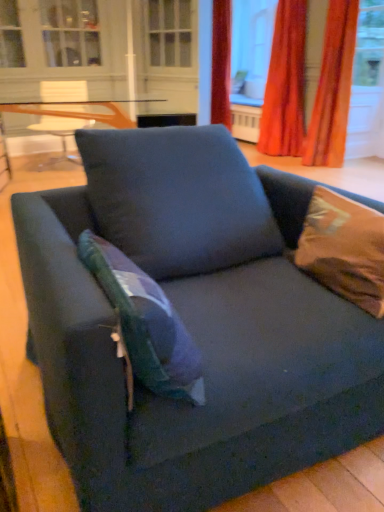
Question: Considering the relative positions of velvet orange curtain at upper right, which appears as the 1th curtain when viewed from the left, and teal fabric pillow at center, which is the 2th pillow in right-to-left order, in the image provided, is velvet orange curtain at upper right, which appears as the 1th curtain when viewed from the left, to the right of teal fabric pillow at center, which is the 2th pillow in right-to-left order, from the viewer's perspective?

Choices:
 (A) yes
 (B) no

Answer: (A)

Question: Can you confirm if velvet orange curtain at upper right, which appears as the 1th curtain when viewed from the left, is wider than teal fabric pillow at center, positioned as the first pillow in left-to-right order?

Choices:
 (A) no
 (B) yes

Answer: (B)

Question: Considering the relative sizes of velvet orange curtain at upper right, which appears as the 2th curtain when viewed from the right, and teal fabric pillow at center, positioned as the first pillow in left-to-right order, in the image provided, is velvet orange curtain at upper right, which appears as the 2th curtain when viewed from the right, taller than teal fabric pillow at center, positioned as the first pillow in left-to-right order,?

Choices:
 (A) yes
 (B) no

Answer: (A)

Question: Is velvet orange curtain at upper right, which appears as the 1th curtain when viewed from the left, not inside teal fabric pillow at center, positioned as the first pillow in left-to-right order?

Choices:
 (A) yes
 (B) no

Answer: (A)

Question: From a real-world perspective, is velvet orange curtain at upper right, which appears as the 1th curtain when viewed from the left, positioned under teal fabric pillow at center, positioned as the first pillow in left-to-right order, based on gravity?

Choices:
 (A) no
 (B) yes

Answer: (A)

Question: From the image's perspective, is velvet orange curtain at upper right, marked as the 2th curtain in a left-to-right arrangement, located above or below transparent glass window screen at upper center?

Choices:
 (A) above
 (B) below

Answer: (B)

Question: Is velvet orange curtain at upper right, the first curtain from the right, taller or shorter than transparent glass window screen at upper center?

Choices:
 (A) tall
 (B) short

Answer: (A)

Question: Based on their sizes in the image, would you say velvet orange curtain at upper right, marked as the 2th curtain in a left-to-right arrangement, is bigger or smaller than transparent glass window screen at upper center?

Choices:
 (A) small
 (B) big

Answer: (A)

Question: Is velvet orange curtain at upper right, marked as the 2th curtain in a left-to-right arrangement, inside or outside of transparent glass window screen at upper center?

Choices:
 (A) outside
 (B) inside

Answer: (A)

Question: From the image's perspective, relative to brown satin pillow at upper right, marked as the 1th pillow in a right-to-left arrangement, is velvet orange curtain at upper right, marked as the 2th curtain in a left-to-right arrangement, above or below?

Choices:
 (A) above
 (B) below

Answer: (A)

Question: Based on their positions, is velvet orange curtain at upper right, the first curtain from the right, located to the left or right of brown satin pillow at upper right, marked as the 1th pillow in a right-to-left arrangement?

Choices:
 (A) right
 (B) left

Answer: (A)

Question: Which is correct: velvet orange curtain at upper right, marked as the 2th curtain in a left-to-right arrangement, is inside brown satin pillow at upper right, marked as the 1th pillow in a right-to-left arrangement, or outside of it?

Choices:
 (A) outside
 (B) inside

Answer: (A)

Question: Considering the positions of velvet orange curtain at upper right, marked as the 2th curtain in a left-to-right arrangement, and brown satin pillow at upper right, marked as the 1th pillow in a right-to-left arrangement, in the image, is velvet orange curtain at upper right, marked as the 2th curtain in a left-to-right arrangement, taller or shorter than brown satin pillow at upper right, marked as the 1th pillow in a right-to-left arrangement,?

Choices:
 (A) tall
 (B) short

Answer: (A)

Question: From a real-world perspective, relative to brown satin pillow at upper right, marked as the 1th pillow in a right-to-left arrangement, is dark blue fabric couch at center vertically above or below?

Choices:
 (A) below
 (B) above

Answer: (A)

Question: Do you think dark blue fabric couch at center is within brown satin pillow at upper right, which is the 2th pillow in left-to-right order, or outside of it?

Choices:
 (A) outside
 (B) inside

Answer: (A)